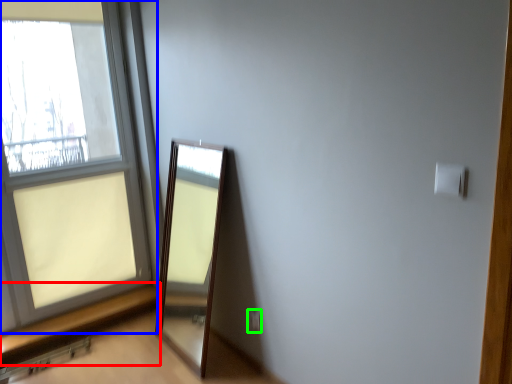
Question: Which is nearer to the window sill (highlighted by a red box)? window (highlighted by a blue box) or electric outlet (highlighted by a green box).

Choices:
 (A) window
 (B) electric outlet

Answer: (A)